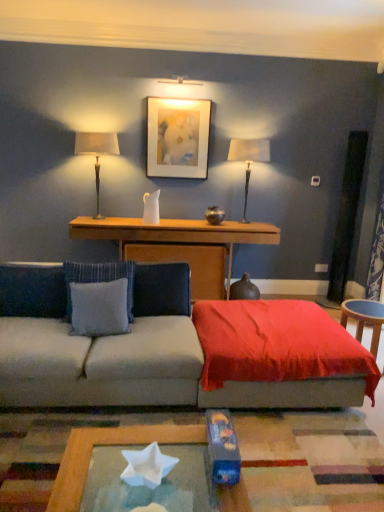
Question: Is blue fabric pillow at left, acting as the 3th pillow starting from the right, at the back of matte white picture frame at upper center?

Choices:
 (A) no
 (B) yes

Answer: (A)

Question: Is matte white picture frame at upper center surrounding blue fabric pillow at left, acting as the 3th pillow starting from the right?

Choices:
 (A) yes
 (B) no

Answer: (B)

Question: From a real-world perspective, is matte white picture frame at upper center under blue fabric pillow at left, the 1th pillow from the left?

Choices:
 (A) yes
 (B) no

Answer: (B)

Question: Does matte white picture frame at upper center have a greater height compared to blue fabric pillow at left, acting as the 3th pillow starting from the right?

Choices:
 (A) yes
 (B) no

Answer: (A)

Question: Is matte white picture frame at upper center not near blue fabric pillow at left, the 1th pillow from the left?

Choices:
 (A) yes
 (B) no

Answer: (A)

Question: Relative to matte white lampshade at right, positioned as the second table lamp in left-to-right order, is blue fabric pillow at center, the 3th pillow in the left-to-right sequence, in front or behind?

Choices:
 (A) front
 (B) behind

Answer: (A)

Question: From the image's perspective, is blue fabric pillow at center, which is the 1th pillow from right to left, positioned above or below matte white lampshade at right, the 1th table lamp viewed from the right?

Choices:
 (A) below
 (B) above

Answer: (A)

Question: From their relative heights in the image, would you say blue fabric pillow at center, which is the 1th pillow from right to left, is taller or shorter than matte white lampshade at right, the 1th table lamp viewed from the right?

Choices:
 (A) short
 (B) tall

Answer: (A)

Question: Looking at the image, does blue fabric pillow at center, which is the 1th pillow from right to left, seem bigger or smaller compared to matte white lampshade at right, the 1th table lamp viewed from the right?

Choices:
 (A) big
 (B) small

Answer: (B)

Question: In terms of size, does satin beige lampshade at left, marked as the 2th table lamp in a right-to-left arrangement, appear bigger or smaller than gray fabric pillow at center, the second pillow viewed from the right?

Choices:
 (A) small
 (B) big

Answer: (B)

Question: From a real-world perspective, is satin beige lampshade at left, marked as the 2th table lamp in a right-to-left arrangement, positioned above or below gray fabric pillow at center, the second pillow viewed from the right?

Choices:
 (A) above
 (B) below

Answer: (A)

Question: From their relative heights in the image, would you say satin beige lampshade at left, which is counted as the 1th table lamp, starting from the left, is taller or shorter than gray fabric pillow at center, which is the 2th pillow from left to right?

Choices:
 (A) short
 (B) tall

Answer: (B)

Question: Is satin beige lampshade at left, which is counted as the 1th table lamp, starting from the left, to the left or to the right of gray fabric pillow at center, which is the 2th pillow from left to right, in the image?

Choices:
 (A) left
 (B) right

Answer: (A)

Question: In the image, is matte white picture frame at upper center positioned in front of or behind velvet red throw at center?

Choices:
 (A) front
 (B) behind

Answer: (B)

Question: Considering the positions of matte white picture frame at upper center and velvet red throw at center in the image, is matte white picture frame at upper center taller or shorter than velvet red throw at center?

Choices:
 (A) short
 (B) tall

Answer: (B)